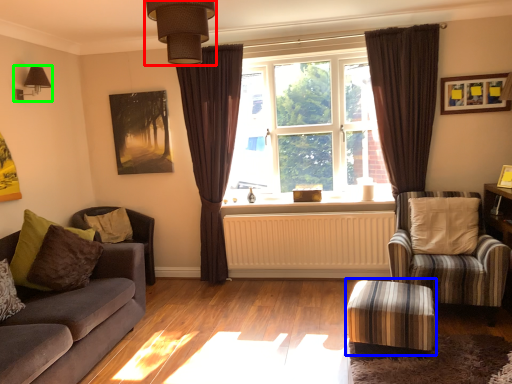
Question: Which is nearer to the light fixture (highlighted by a red box)? stool (highlighted by a blue box) or light fixture (highlighted by a green box).

Choices:
 (A) stool
 (B) light fixture

Answer: (A)